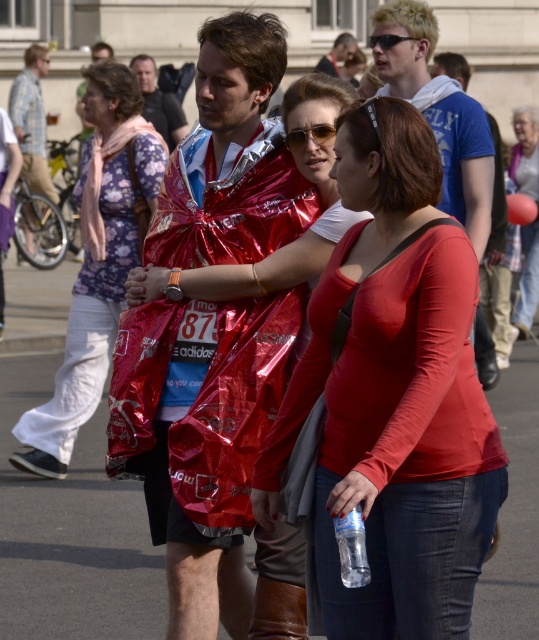
Question: Is matte red shirt at center wider than matte red jacket at center?

Choices:
 (A) no
 (B) yes

Answer: (A)

Question: Which point is closer to the camera taking this photo?

Choices:
 (A) (515, 156)
 (B) (30, 179)

Answer: (A)

Question: Is blue cotton t-shirt at center wider than brushed metal bicycle at left?

Choices:
 (A) yes
 (B) no

Answer: (A)

Question: Which object is the closest to the matte red raincoat at center?

Choices:
 (A) matte red jacket at center
 (B) shiny plastic bag at center
 (C) brushed metal bicycle at left
 (D) floral fabric blouse at left

Answer: (C)

Question: Does floral fabric blouse at left have a greater width compared to matte red raincoat at center?

Choices:
 (A) yes
 (B) no

Answer: (A)

Question: Considering the real-world distances, which object is closest to the matte red shirt at center?

Choices:
 (A) brushed metal bicycle at left
 (B) blue cotton t-shirt at center
 (C) matte plastic bag at center

Answer: (B)